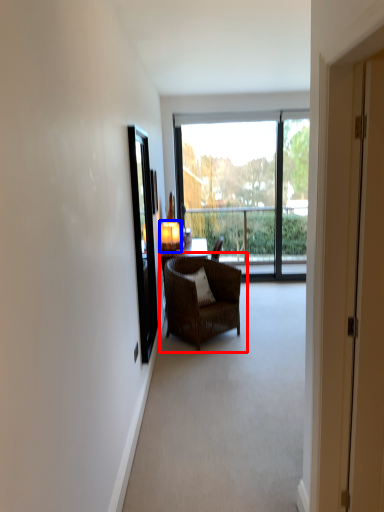
Question: Which object appears farthest to the camera in this image, chair (highlighted by a red box) or lamp (highlighted by a blue box)?

Choices:
 (A) chair
 (B) lamp

Answer: (B)